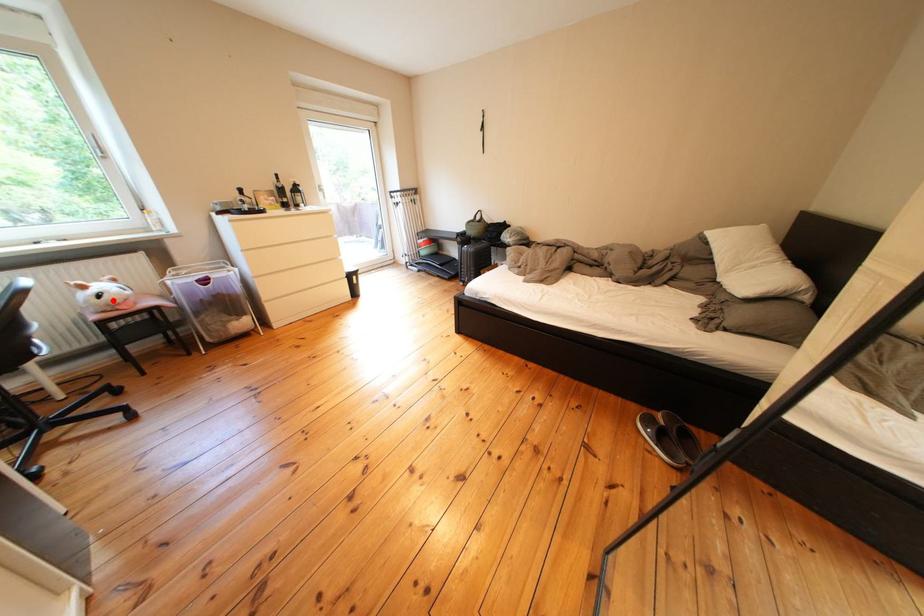
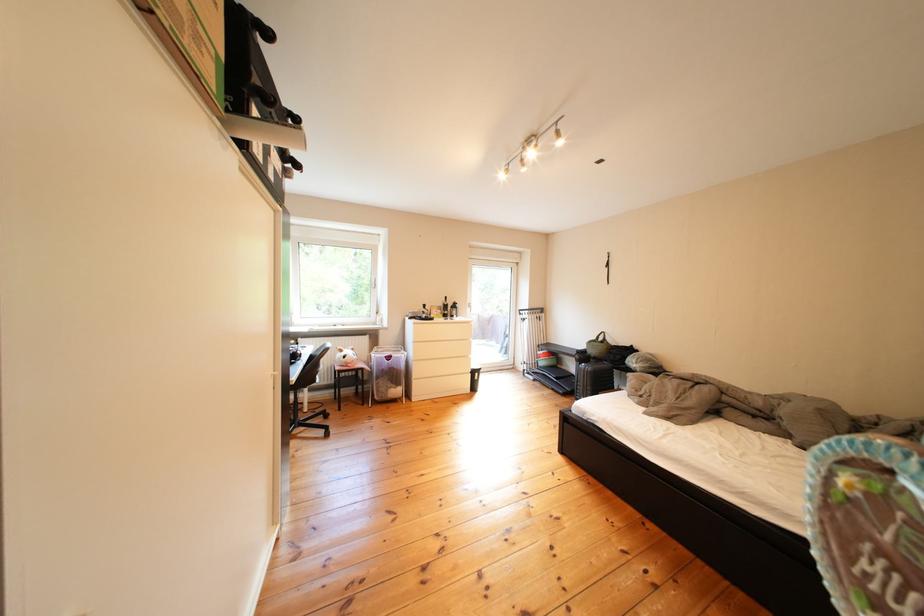
In the second image, find the point that corresponds to the highlighted location in the first image.

(359, 361)